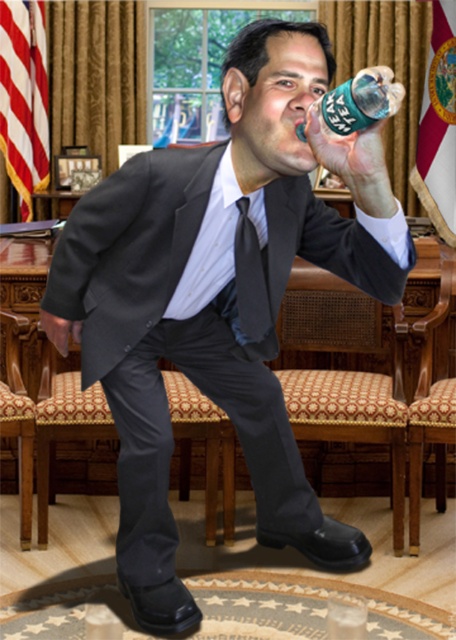
Question: Considering the real-world distances, which object is farthest from the fabric upholstered chair at center?

Choices:
 (A) wooden polished chair at center
 (B) woven fabric chair at center
 (C) green plastic bottle at upper center

Answer: (C)

Question: Is wooden polished chair at center to the right of striped fabric tie at center from the viewer's perspective?

Choices:
 (A) no
 (B) yes

Answer: (B)

Question: Does woven fabric chair at center have a larger size compared to striped fabric tie at center?

Choices:
 (A) yes
 (B) no

Answer: (A)

Question: Where is woven fabric chair at center located in relation to patterned fabric chair at lower left in the image?

Choices:
 (A) right
 (B) left

Answer: (A)

Question: Which of the following is the farthest from the observer?

Choices:
 (A) striped fabric tie at center
 (B) wooden polished chair at center

Answer: (B)

Question: Among these objects, which one is nearest to the camera?

Choices:
 (A) wooden polished chair at center
 (B) striped fabric tie at center

Answer: (B)